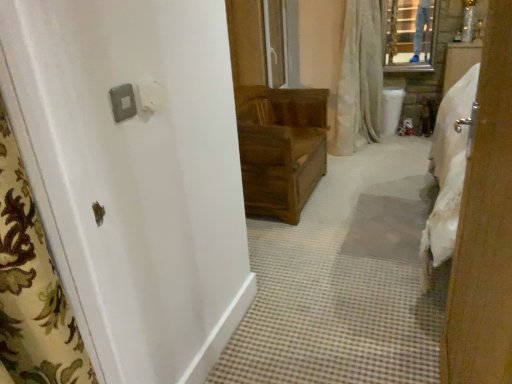
Question: Is white plastic light switch at upper left, which is counted as the second light switch, starting from the left, a part of white textured shower curtain at upper center?

Choices:
 (A) no
 (B) yes

Answer: (A)

Question: Is white textured shower curtain at upper center at the right side of white plastic light switch at upper left, the first light switch viewed from the right?

Choices:
 (A) no
 (B) yes

Answer: (B)

Question: Considering the relative sizes of white textured shower curtain at upper center and white plastic light switch at upper left, which is counted as the second light switch, starting from the left, in the image provided, is white textured shower curtain at upper center thinner than white plastic light switch at upper left, which is counted as the second light switch, starting from the left,?

Choices:
 (A) no
 (B) yes

Answer: (A)

Question: From the image's perspective, is white textured shower curtain at upper center located beneath white plastic light switch at upper left, which is counted as the second light switch, starting from the left?

Choices:
 (A) no
 (B) yes

Answer: (A)

Question: Considering the relative sizes of white textured shower curtain at upper center and white plastic light switch at upper left, the first light switch viewed from the right, in the image provided, is white textured shower curtain at upper center taller than white plastic light switch at upper left, the first light switch viewed from the right,?

Choices:
 (A) yes
 (B) no

Answer: (A)

Question: Is white textured shower curtain at upper center positioned before white plastic light switch at upper left, the first light switch viewed from the right?

Choices:
 (A) no
 (B) yes

Answer: (A)

Question: Is satin silver switch at upper left, acting as the 2th light switch starting from the right, positioned beyond the bounds of white textured shower curtain at upper center?

Choices:
 (A) no
 (B) yes

Answer: (B)

Question: Considering the relative positions of satin silver switch at upper left, which ranks as the first light switch in left-to-right order, and white textured shower curtain at upper center in the image provided, is satin silver switch at upper left, which ranks as the first light switch in left-to-right order, to the right of white textured shower curtain at upper center from the viewer's perspective?

Choices:
 (A) yes
 (B) no

Answer: (B)

Question: Can you confirm if satin silver switch at upper left, acting as the 2th light switch starting from the right, is smaller than white textured shower curtain at upper center?

Choices:
 (A) yes
 (B) no

Answer: (A)

Question: From the image's perspective, is satin silver switch at upper left, which ranks as the first light switch in left-to-right order, under white textured shower curtain at upper center?

Choices:
 (A) no
 (B) yes

Answer: (B)

Question: Are satin silver switch at upper left, acting as the 2th light switch starting from the right, and white textured shower curtain at upper center located far from each other?

Choices:
 (A) no
 (B) yes

Answer: (B)

Question: Does satin silver switch at upper left, which ranks as the first light switch in left-to-right order, come behind white textured shower curtain at upper center?

Choices:
 (A) no
 (B) yes

Answer: (A)

Question: From the image's perspective, is white plastic light switch at upper left, the first light switch viewed from the right, on satin silver switch at upper left, acting as the 2th light switch starting from the right?

Choices:
 (A) yes
 (B) no

Answer: (A)